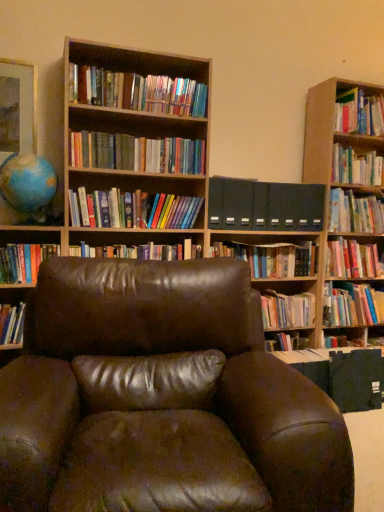
Question: Is the depth of hardcover book at upper right, the 9th book when ordered from bottom to top, less than that of hardcover book at upper right, which is counted as the 13th book, starting from the bottom?

Choices:
 (A) no
 (B) yes

Answer: (A)

Question: From the image's perspective, is hardcover book at upper right, acting as the 5th book starting from the top, beneath hardcover book at upper right, which is counted as the 13th book, starting from the bottom?

Choices:
 (A) no
 (B) yes

Answer: (B)

Question: From the image's perspective, is hardcover book at upper right, acting as the 5th book starting from the top, above hardcover book at upper right, positioned as the first book in top-to-bottom order?

Choices:
 (A) no
 (B) yes

Answer: (A)

Question: Is hardcover book at upper right, acting as the 5th book starting from the top, positioned beyond the bounds of hardcover book at upper right, which is counted as the 13th book, starting from the bottom?

Choices:
 (A) no
 (B) yes

Answer: (B)

Question: Does hardcover book at upper right, acting as the 5th book starting from the top, turn towards hardcover book at upper right, positioned as the first book in top-to-bottom order?

Choices:
 (A) yes
 (B) no

Answer: (B)

Question: From the image's perspective, is hardcover book at upper right, positioned as the first book in top-to-bottom order, positioned above or below brown leather chair at center?

Choices:
 (A) below
 (B) above

Answer: (B)

Question: Is hardcover book at upper right, which is counted as the 13th book, starting from the bottom, inside the boundaries of brown leather chair at center, or outside?

Choices:
 (A) inside
 (B) outside

Answer: (B)

Question: From a real-world perspective, is hardcover book at upper right, which is counted as the 13th book, starting from the bottom, above or below brown leather chair at center?

Choices:
 (A) below
 (B) above

Answer: (B)

Question: Looking at their shapes, would you say hardcover book at upper right, which is counted as the 13th book, starting from the bottom, is wider or thinner than brown leather chair at center?

Choices:
 (A) wide
 (B) thin

Answer: (B)

Question: From a real-world perspective, relative to brown wooden bookcase at upper center, is hardcover books at center, the tenth book from the bottom, vertically above or below?

Choices:
 (A) below
 (B) above

Answer: (B)

Question: In the image, is hardcover books at center, the tenth book from the bottom, on the left side or the right side of brown wooden bookcase at upper center?

Choices:
 (A) left
 (B) right

Answer: (A)

Question: Considering the positions of hardcover books at center, the tenth book from the bottom, and brown wooden bookcase at upper center in the image, is hardcover books at center, the tenth book from the bottom, bigger or smaller than brown wooden bookcase at upper center?

Choices:
 (A) big
 (B) small

Answer: (B)

Question: Is point (104, 157) closer or farther from the camera than point (69, 166)?

Choices:
 (A) farther
 (B) closer

Answer: (A)

Question: Does point 183,250 appear closer or farther from the camera than point 1,325?

Choices:
 (A) closer
 (B) farther

Answer: (B)

Question: Considering the positions of hardcover books at center, marked as the 7th book in a bottom-to-top arrangement, and hardcover book at left, the twelfth book in the top-to-bottom sequence, in the image, is hardcover books at center, marked as the 7th book in a bottom-to-top arrangement, wider or thinner than hardcover book at left, the twelfth book in the top-to-bottom sequence,?

Choices:
 (A) wide
 (B) thin

Answer: (A)